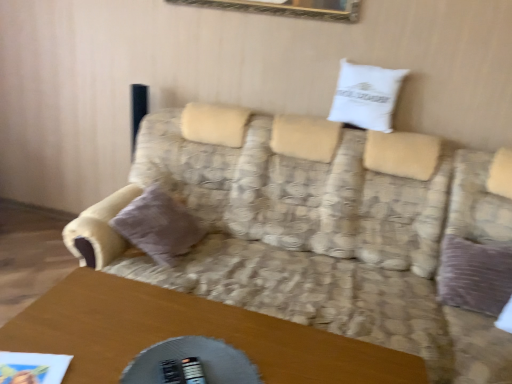
The height and width of the screenshot is (384, 512). I want to click on patterned fabric couch at center, so click(318, 228).

What do you see at coordinates (366, 96) in the screenshot?
I see `white cotton pillow at upper center, the first pillow when ordered from right to left` at bounding box center [366, 96].

The width and height of the screenshot is (512, 384). I want to click on patterned fabric couch at center, so click(318, 228).

Relative to wooden table at lower center, is patterned fabric couch at center in front or behind?

In the image, patterned fabric couch at center appears behind wooden table at lower center.

Based on the photo, is the surface of patterned fabric couch at center in direct contact with wooden table at lower center?

They are not placed beside each other.

Between patterned fabric couch at center and wooden table at lower center, which one has larger size?

patterned fabric couch at center is bigger.

Could you tell me if patterned fabric couch at center is facing wooden table at lower center?

Yes.

In terms of width, does white cotton pillow at upper center, which appears as the first pillow when viewed from the top, look wider or thinner when compared to patterned fabric couch at center?

white cotton pillow at upper center, which appears as the first pillow when viewed from the top, is thinner than patterned fabric couch at center.

Can you confirm if white cotton pillow at upper center, which is the 2th pillow in bottom-to-top order, is positioned to the right of patterned fabric couch at center?

Correct, you'll find white cotton pillow at upper center, which is the 2th pillow in bottom-to-top order, to the right of patterned fabric couch at center.

Is white cotton pillow at upper center, the first pillow when ordered from right to left, positioned beyond the bounds of patterned fabric couch at center?

Yes, white cotton pillow at upper center, the first pillow when ordered from right to left, is located beyond the bounds of patterned fabric couch at center.

Considering their positions, is velvet purple pillow at left, marked as the first pillow in a bottom-to-top arrangement, located in front of or behind patterned fabric couch at center?

velvet purple pillow at left, marked as the first pillow in a bottom-to-top arrangement, is positioned farther from the viewer than patterned fabric couch at center.

Which is behind, point (166, 225) or point (219, 265)?

The point (219, 265) is farther from the camera.

Is velvet purple pillow at left, marked as the first pillow in a bottom-to-top arrangement, wider or thinner than patterned fabric couch at center?

Clearly, velvet purple pillow at left, marked as the first pillow in a bottom-to-top arrangement, has less width compared to patterned fabric couch at center.

Considering the positions of objects velvet purple pillow at left, which is counted as the 2th pillow, starting from the top, and patterned fabric couch at center in the image provided, who is more to the left, velvet purple pillow at left, which is counted as the 2th pillow, starting from the top, or patterned fabric couch at center?

velvet purple pillow at left, which is counted as the 2th pillow, starting from the top, is more to the left.

From the image's perspective, starting from the wooden table at lower center, which pillow is the 1st one above? Please provide its 2D coordinates.

[(158, 226)]

Between velvet purple pillow at left, which is counted as the 2th pillow, starting from the right, and wooden table at lower center, which one is positioned in front?

wooden table at lower center is in front.

Consider the image. From the image's perspective, is velvet purple pillow at left, which is counted as the 2th pillow, starting from the right, located above or below white cotton pillow at upper center, which appears as the first pillow when viewed from the top?

Clearly, from the image's perspective, velvet purple pillow at left, which is counted as the 2th pillow, starting from the right, is below white cotton pillow at upper center, which appears as the first pillow when viewed from the top.

Is velvet purple pillow at left, positioned as the 1th pillow in left-to-right order, oriented away from white cotton pillow at upper center, marked as the 2th pillow in a left-to-right arrangement?

No, velvet purple pillow at left, positioned as the 1th pillow in left-to-right order, is not facing the opposite direction of white cotton pillow at upper center, marked as the 2th pillow in a left-to-right arrangement.

Is velvet purple pillow at left, which is counted as the 2th pillow, starting from the top, in front of or behind white cotton pillow at upper center, the first pillow when ordered from right to left, in the image?

velvet purple pillow at left, which is counted as the 2th pillow, starting from the top, is in front of white cotton pillow at upper center, the first pillow when ordered from right to left.

Considering the relative sizes of patterned fabric couch at center and velvet purple pillow at left, positioned as the 1th pillow in left-to-right order, in the image provided, is patterned fabric couch at center shorter than velvet purple pillow at left, positioned as the 1th pillow in left-to-right order,?

No, patterned fabric couch at center is not shorter than velvet purple pillow at left, positioned as the 1th pillow in left-to-right order.

How far apart are patterned fabric couch at center and velvet purple pillow at left, marked as the first pillow in a bottom-to-top arrangement?

patterned fabric couch at center and velvet purple pillow at left, marked as the first pillow in a bottom-to-top arrangement, are 17.98 inches apart from each other.

Does patterned fabric couch at center come behind velvet purple pillow at left, which is counted as the 2th pillow, starting from the right?

No.

Is patterned fabric couch at center thinner than velvet purple pillow at left, marked as the first pillow in a bottom-to-top arrangement?

No.

Are wooden table at lower center and white cotton pillow at upper center, the first pillow when ordered from right to left, far apart?

Indeed, wooden table at lower center is not near white cotton pillow at upper center, the first pillow when ordered from right to left.

How different are the orientations of wooden table at lower center and white cotton pillow at upper center, which appears as the first pillow when viewed from the top, in degrees?

They differ by 13 degrees in their facing directions.

Considering the positions of point (121, 310) and point (364, 101), is point (121, 310) closer or farther from the camera than point (364, 101)?

Point (121, 310).

From the image's perspective, between wooden table at lower center and white cotton pillow at upper center, marked as the 2th pillow in a left-to-right arrangement, who is located below?

wooden table at lower center is shown below in the image.

Locate an element on the screen. table below the patterned fabric couch at center (from the image's perspective) is located at coordinates (187, 334).

Locate an element on the screen. This screenshot has width=512, height=384. studio couch that is under the white cotton pillow at upper center, the first pillow when ordered from right to left (from a real-world perspective) is located at coordinates (318, 228).

Looking at the image, which one is located further to white cotton pillow at upper center, marked as the 2th pillow in a left-to-right arrangement, velvet purple pillow at left, which is counted as the 2th pillow, starting from the top, or wooden table at lower center?

Among the two, wooden table at lower center is located further to white cotton pillow at upper center, marked as the 2th pillow in a left-to-right arrangement.

Estimate the real-world distances between objects in this image. Which object is closer to wooden table at lower center, patterned fabric couch at center or white cotton pillow at upper center, the first pillow when ordered from right to left?

patterned fabric couch at center lies closer to wooden table at lower center than the other object.

Estimate the real-world distances between objects in this image. Which object is closer to wooden table at lower center, velvet purple pillow at left, which is counted as the 2th pillow, starting from the right, or patterned fabric couch at center?

The object closer to wooden table at lower center is velvet purple pillow at left, which is counted as the 2th pillow, starting from the right.

Estimate the real-world distances between objects in this image. Which object is further from velvet purple pillow at left, which is counted as the 2th pillow, starting from the right, patterned fabric couch at center or white cotton pillow at upper center, marked as the 2th pillow in a left-to-right arrangement?

white cotton pillow at upper center, marked as the 2th pillow in a left-to-right arrangement, lies further to velvet purple pillow at left, which is counted as the 2th pillow, starting from the right, than the other object.

Considering their positions, is velvet purple pillow at left, which is counted as the 2th pillow, starting from the right, positioned closer to patterned fabric couch at center than wooden table at lower center?

velvet purple pillow at left, which is counted as the 2th pillow, starting from the right, is positioned closer to the anchor patterned fabric couch at center.

When comparing their distances from patterned fabric couch at center, does wooden table at lower center or white cotton pillow at upper center, marked as the 2th pillow in a left-to-right arrangement, seem further?

wooden table at lower center.

Estimate the real-world distances between objects in this image. Which object is closer to patterned fabric couch at center, white cotton pillow at upper center, marked as the 2th pillow in a left-to-right arrangement, or wooden table at lower center?

white cotton pillow at upper center, marked as the 2th pillow in a left-to-right arrangement, is closer to patterned fabric couch at center.

When comparing their distances from velvet purple pillow at left, positioned as the 1th pillow in left-to-right order, does patterned fabric couch at center or wooden table at lower center seem closer?

patterned fabric couch at center is closer to velvet purple pillow at left, positioned as the 1th pillow in left-to-right order.

At what (x,y) coordinates should I click in order to perform the action: click on studio couch between velvet purple pillow at left, which is counted as the 2th pillow, starting from the right, and white cotton pillow at upper center, which is the 2th pillow in bottom-to-top order, in the horizontal direction. Please return your answer as a coordinate pair (x, y). This screenshot has height=384, width=512. Looking at the image, I should click on (318, 228).

Identify the location of pillow located between wooden table at lower center and white cotton pillow at upper center, the first pillow when ordered from right to left, in the depth direction. (158, 226).

The image size is (512, 384). I want to click on studio couch between wooden table at lower center and velvet purple pillow at left, which is counted as the 2th pillow, starting from the top, along the z-axis, so click(318, 228).

Identify the location of studio couch between wooden table at lower center and white cotton pillow at upper center, which is the 2th pillow in bottom-to-top order, along the z-axis. The width and height of the screenshot is (512, 384). (318, 228).